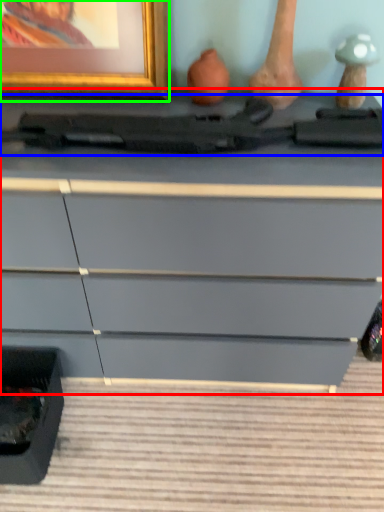
Question: Estimate the real-world distances between objects in this image. Which object is closer to chest of drawers (highlighted by a red box), equipment (highlighted by a blue box) or picture frame (highlighted by a green box)?

Choices:
 (A) equipment
 (B) picture frame

Answer: (A)